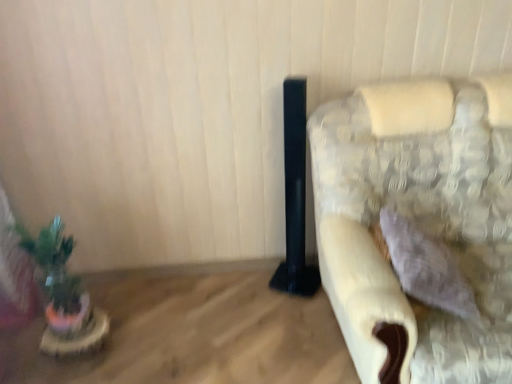
Question: Is wooden table at lower left at the right side of fluffy fabric couch at right?

Choices:
 (A) no
 (B) yes

Answer: (A)

Question: From the image's perspective, is wooden table at lower left below fluffy fabric couch at right?

Choices:
 (A) yes
 (B) no

Answer: (A)

Question: Is wooden table at lower left to the left of fluffy fabric couch at right from the viewer's perspective?

Choices:
 (A) no
 (B) yes

Answer: (B)

Question: From a real-world perspective, does wooden table at lower left sit lower than fluffy fabric couch at right?

Choices:
 (A) no
 (B) yes

Answer: (B)

Question: From the image's perspective, is wooden table at lower left on fluffy fabric couch at right?

Choices:
 (A) yes
 (B) no

Answer: (B)

Question: Considering the relative sizes of wooden table at lower left and fluffy fabric couch at right in the image provided, is wooden table at lower left shorter than fluffy fabric couch at right?

Choices:
 (A) no
 (B) yes

Answer: (B)

Question: Could you tell me if green matte plant at left is facing fluffy fabric couch at right?

Choices:
 (A) yes
 (B) no

Answer: (B)

Question: Is green matte plant at left far away from fluffy fabric couch at right?

Choices:
 (A) yes
 (B) no

Answer: (A)

Question: Does green matte plant at left lie behind fluffy fabric couch at right?

Choices:
 (A) no
 (B) yes

Answer: (B)

Question: From a real-world perspective, is green matte plant at left positioned under fluffy fabric couch at right based on gravity?

Choices:
 (A) no
 (B) yes

Answer: (B)

Question: Is green matte plant at left outside fluffy fabric couch at right?

Choices:
 (A) yes
 (B) no

Answer: (A)

Question: From the image's perspective, is green matte plant at left over fluffy fabric couch at right?

Choices:
 (A) yes
 (B) no

Answer: (B)

Question: Does fluffy fabric couch at right have a greater width compared to wooden table at lower left?

Choices:
 (A) yes
 (B) no

Answer: (B)